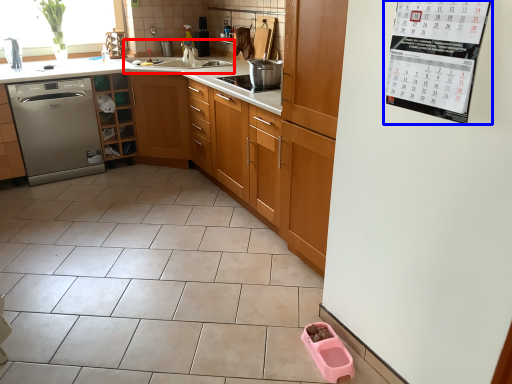
Question: Which point is closer to the camera, sink (highlighted by a red box) or bulletin board (highlighted by a blue box)?

Choices:
 (A) sink
 (B) bulletin board

Answer: (B)